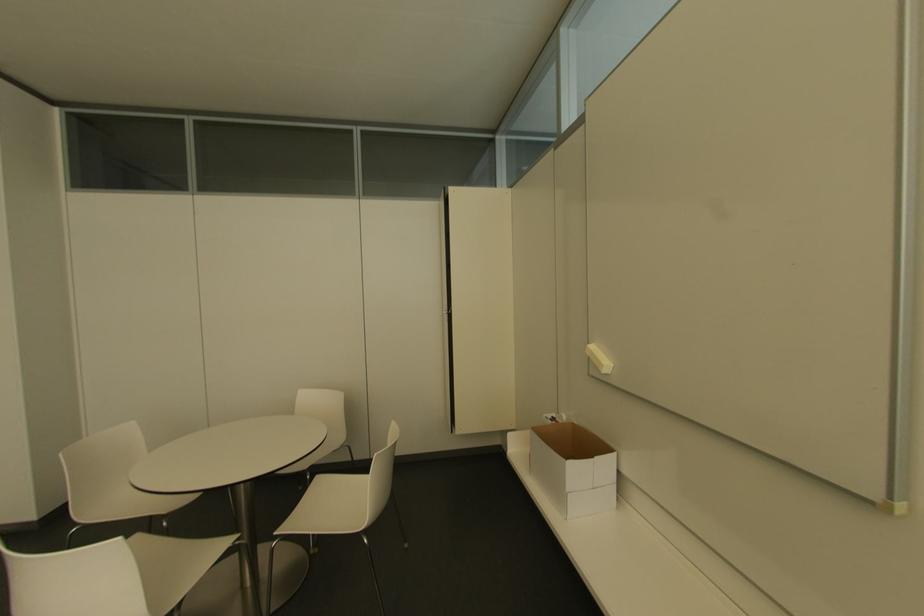
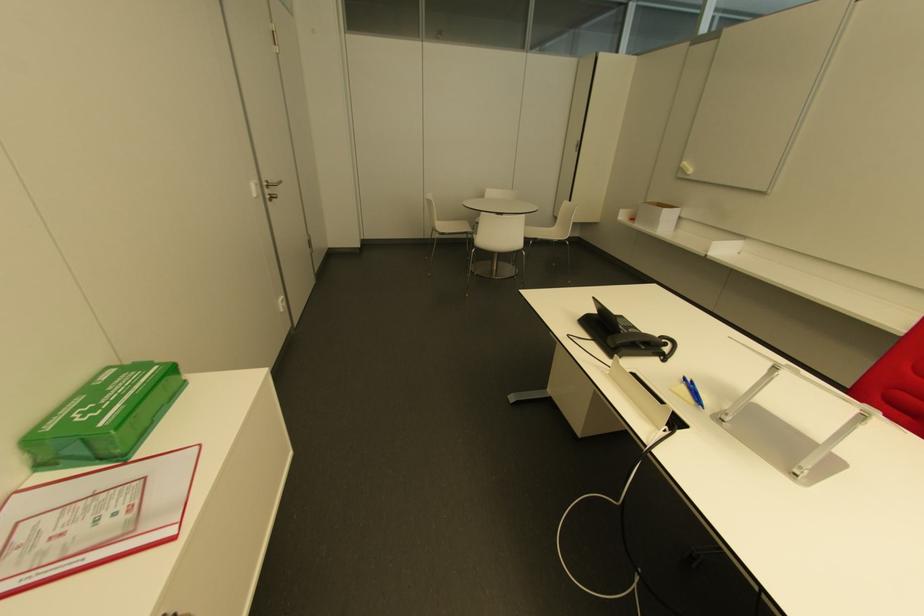
Question: I am providing you with two images of the same scene from different viewpoints. Which of the following objects are not visible in image2?

Choices:
 (A) silver laptop stand
 (B) blue pen
 (C) chair sitting surface
 (D) none of these

Answer: (D)